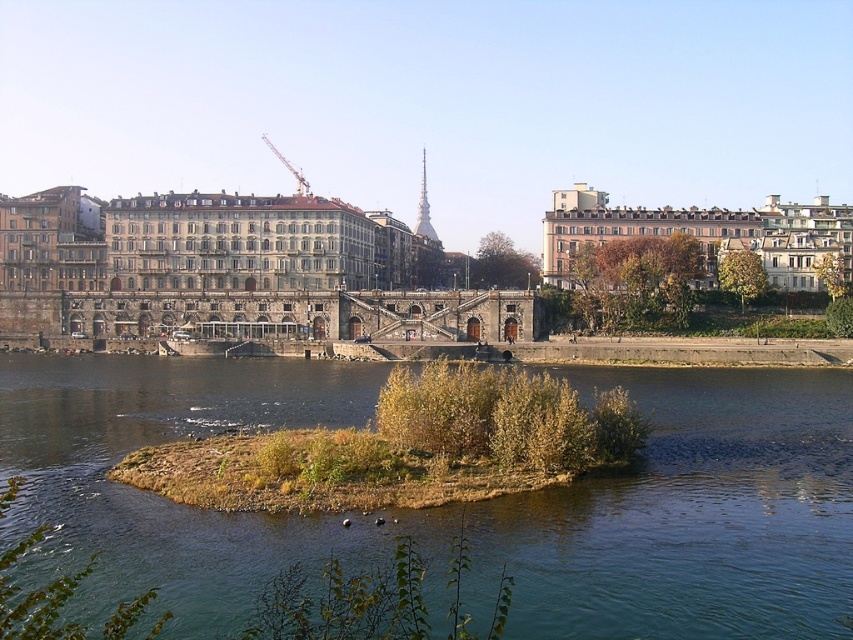
Can you confirm if greenish-blue water at center is positioned above metallic gray crane at upper center?

Actually, greenish-blue water at center is below metallic gray crane at upper center.

Can you confirm if greenish-blue water at center is positioned below metallic gray crane at upper center?

Correct, greenish-blue water at center is located below metallic gray crane at upper center.

Which is in front, point (20, 358) or point (299, 184)?

Point (20, 358)

Find the location of a particular element. The image size is (853, 640). greenish-blue water at center is located at coordinates (689, 515).